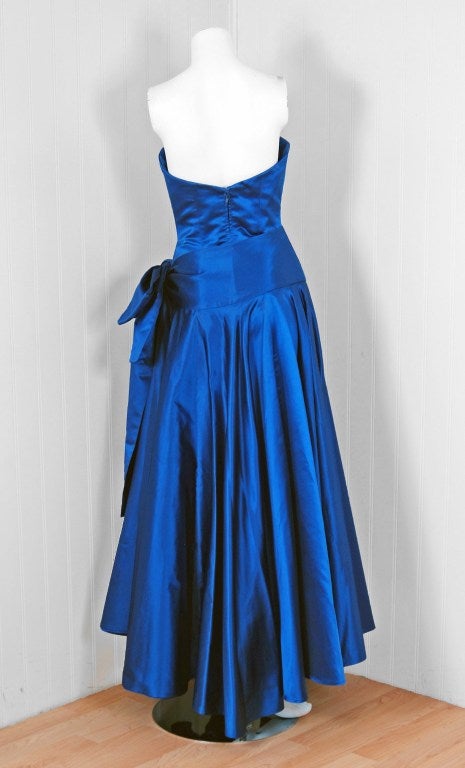
Identify the location of wall. (412, 650).